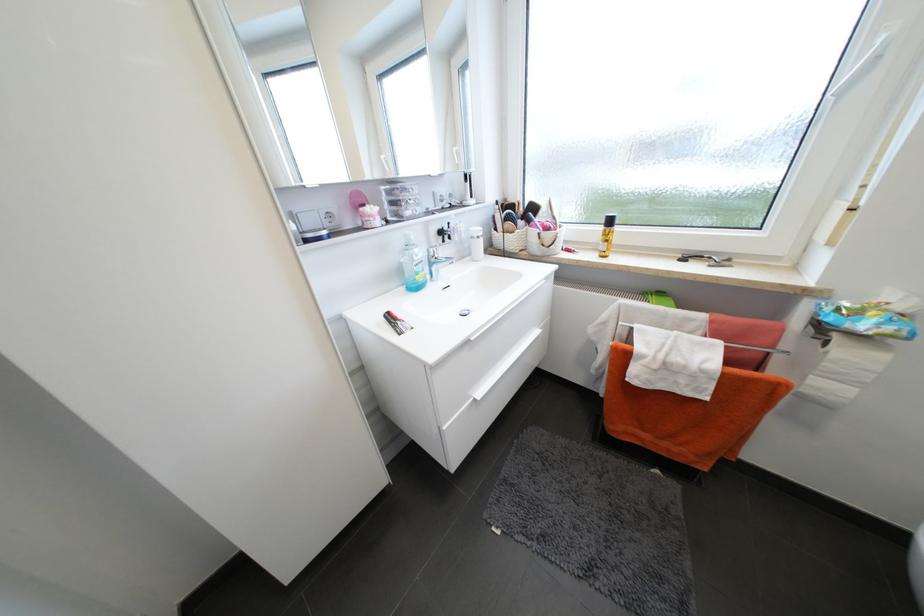
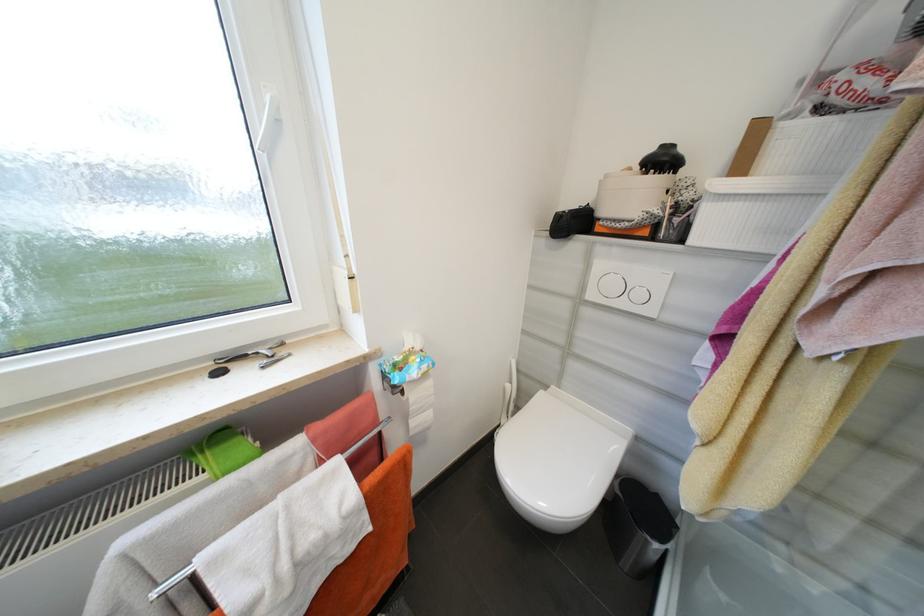
Question: The camera is either moving clockwise (left) or counter-clockwise (right) around the object. The first image is from the beginning of the video and the second image is from the end. Is the camera moving left or right when shooting the video?

Choices:
 (A) Left
 (B) Right

Answer: (A)